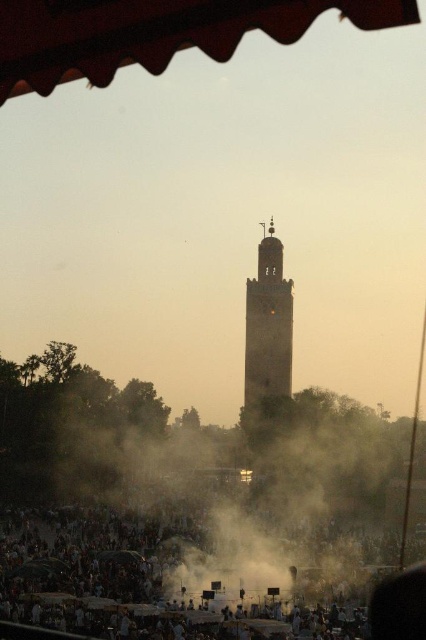
Question: Among these points, which one is nearest to the camera?

Choices:
 (A) (267, 259)
 (B) (351, 10)

Answer: (B)

Question: Can you confirm if dark brown fabric crowd at lower center is thinner than wooden textured awning at upper center?

Choices:
 (A) yes
 (B) no

Answer: (B)

Question: Observing the image, what is the correct spatial positioning of wooden textured awning at upper center in reference to brown stone tower at center?

Choices:
 (A) right
 (B) left

Answer: (B)

Question: Estimate the real-world distances between objects in this image. Which object is closer to the wooden textured awning at upper center?

Choices:
 (A) dark brown fabric crowd at lower center
 (B) brown stone tower at center

Answer: (B)

Question: Which object is the closest to the brown stone tower at center?

Choices:
 (A) wooden textured awning at upper center
 (B) dark brown fabric crowd at lower center

Answer: (B)

Question: Can you confirm if wooden textured awning at upper center is positioned above brown stone tower at center?

Choices:
 (A) yes
 (B) no

Answer: (A)